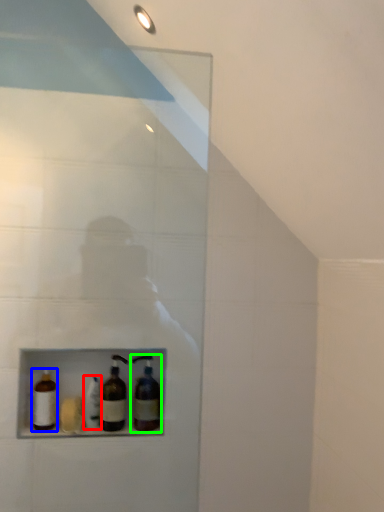
Question: Estimate the real-world distances between objects in this image. Which object is farther from bottle (highlighted by a red box), bottle (highlighted by a blue box) or bottle (highlighted by a green box)?

Choices:
 (A) bottle
 (B) bottle

Answer: (B)